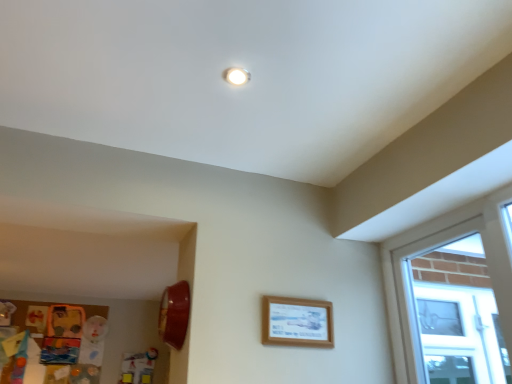
At what (x,y) coordinates should I click in order to perform the action: click on wooden frame at center. Please return your answer as a coordinate pair (x, y). This screenshot has width=512, height=384. Looking at the image, I should click on point(297,322).

Describe the element at coordinates (297, 322) in the screenshot. The width and height of the screenshot is (512, 384). I see `wooden frame at center` at that location.

Image resolution: width=512 pixels, height=384 pixels. Identify the location of wooden frame at center. (297, 322).